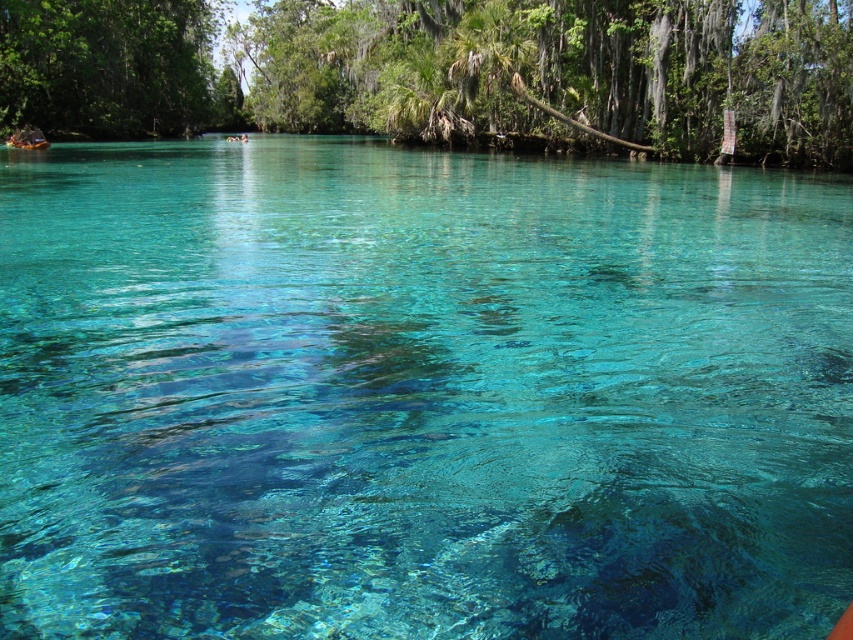
You are standing at the edge of the turquoise water and looking towards the background. Which of the two green leafy trees, the green leafy tree at upper center or the green leafy tree at upper left, appears larger in the scene?

The green leafy tree at upper center appears larger than the green leafy tree at upper left.

You are standing at the origin point in the scene. Which of the two points, point (550, 122) or point (178, 35), is closer to you?

Point (550, 122) is closer to you because it is in front of point (178, 35).